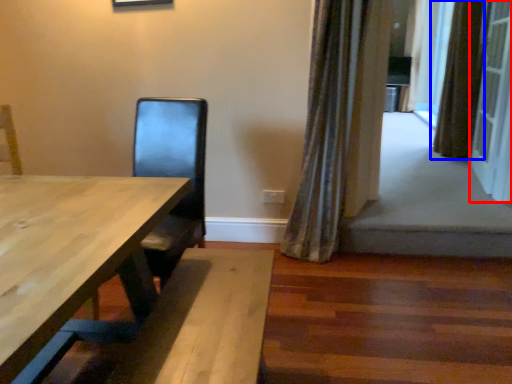
Question: Which of the following is the closest to the observer, screen door (highlighted by a red box) or curtain (highlighted by a blue box)?

Choices:
 (A) screen door
 (B) curtain

Answer: (A)